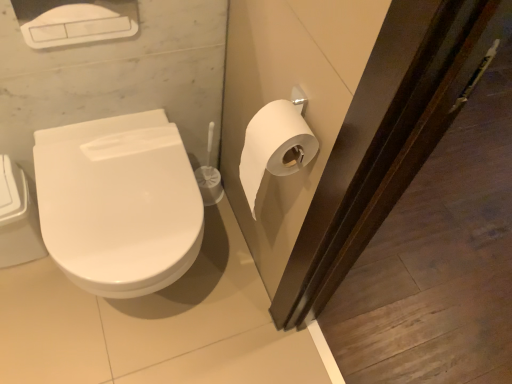
Identify the location of white glossy toilet at left. This screenshot has width=512, height=384. (118, 203).

Describe the element at coordinates (118, 203) in the screenshot. Image resolution: width=512 pixels, height=384 pixels. I see `white glossy toilet at left` at that location.

Measure the distance between white glossy toilet at left and camera.

A distance of 36.21 inches exists between white glossy toilet at left and camera.

Based on the photo, what is the approximate height of white matte toilet paper at right?

white matte toilet paper at right is 11.52 inches tall.

Where is `white matte toilet paper at right`? Image resolution: width=512 pixels, height=384 pixels. white matte toilet paper at right is located at coordinates (274, 148).

The image size is (512, 384). What do you see at coordinates (274, 148) in the screenshot?
I see `white matte toilet paper at right` at bounding box center [274, 148].

Where is `white glossy toilet at left`? This screenshot has height=384, width=512. white glossy toilet at left is located at coordinates (118, 203).

Which is more to the right, white matte toilet paper at right or white glossy toilet at left?

From the viewer's perspective, white matte toilet paper at right appears more on the right side.

Is white matte toilet paper at right positioned before white glossy toilet at left?

Yes, white matte toilet paper at right is in front of white glossy toilet at left.

Considering the points (316, 143) and (58, 228), which point is in front, point (316, 143) or point (58, 228)?

The point (316, 143) is more forward.

From the image's perspective, which one is positioned lower, white matte toilet paper at right or white glossy toilet at left?

white glossy toilet at left appears lower in the image.

From a real-world perspective, is white matte toilet paper at right above or below white glossy toilet at left?

white matte toilet paper at right is situated higher than white glossy toilet at left in the real world.

In terms of width, does white matte toilet paper at right look wider or thinner when compared to white glossy toilet at left?

Clearly, white matte toilet paper at right has less width compared to white glossy toilet at left.

Considering the sizes of objects white matte toilet paper at right and white glossy toilet at left in the image provided, who is shorter, white matte toilet paper at right or white glossy toilet at left?

With less height is white matte toilet paper at right.

Is white matte toilet paper at right bigger than white glossy toilet at left?

No, white matte toilet paper at right is not bigger than white glossy toilet at left.

Is white glossy toilet at left a part of white matte toilet paper at right?

Actually, white glossy toilet at left is outside white matte toilet paper at right.

Are white matte toilet paper at right and white glossy toilet at left located far from each other?

That's not correct — white matte toilet paper at right is a little close to white glossy toilet at left.

Is white matte toilet paper at right facing away from white glossy toilet at left?

No, white glossy toilet at left is not at the back of white matte toilet paper at right.

How different are the orientations of white matte toilet paper at right and white glossy toilet at left in degrees?

The angular difference between white matte toilet paper at right and white glossy toilet at left is 89.8 degrees.

Where is `toilet paper above the white glossy toilet at left (from the image's perspective)`? The image size is (512, 384). toilet paper above the white glossy toilet at left (from the image's perspective) is located at coordinates (274, 148).

Considering the positions of objects white glossy toilet at left and white matte toilet paper at right in the image provided, who is more to the right, white glossy toilet at left or white matte toilet paper at right?

white matte toilet paper at right is more to the right.

Is white glossy toilet at left in front of or behind white matte toilet paper at right in the image?

Clearly, white glossy toilet at left is behind white matte toilet paper at right.

Which is closer, (133, 243) or (286, 130)?

The point (286, 130) is more forward.

From the image's perspective, would you say white glossy toilet at left is shown under white matte toilet paper at right?

Yes, from the image's perspective, white glossy toilet at left is beneath white matte toilet paper at right.

From a real-world perspective, between white glossy toilet at left and white matte toilet paper at right, who is vertically lower?

white glossy toilet at left is physically lower.

Looking at their sizes, would you say white glossy toilet at left is wider or thinner than white matte toilet paper at right?

In the image, white glossy toilet at left appears to be wider than white matte toilet paper at right.

Who is shorter, white glossy toilet at left or white matte toilet paper at right?

white matte toilet paper at right is shorter.

Considering the relative sizes of white glossy toilet at left and white matte toilet paper at right in the image provided, is white glossy toilet at left smaller than white matte toilet paper at right?

Actually, white glossy toilet at left might be larger than white matte toilet paper at right.

Is white glossy toilet at left located outside white matte toilet paper at right?

white glossy toilet at left is positioned outside white matte toilet paper at right.

Is white glossy toilet at left not near white matte toilet paper at right?

white glossy toilet at left is actually quite close to white matte toilet paper at right.

Is white glossy toilet at left aimed at white matte toilet paper at right?

No.

How different are the orientations of white glossy toilet at left and white matte toilet paper at right in degrees?

There is a 89.8-degree angle between the facing directions of white glossy toilet at left and white matte toilet paper at right.

Locate an element on the screen. Image resolution: width=512 pixels, height=384 pixels. toilet paper located above the white glossy toilet at left (from a real-world perspective) is located at coordinates (274, 148).

At what (x,y) coordinates should I click in order to perform the action: click on toilet paper on the right of white glossy toilet at left. Please return your answer as a coordinate pair (x, y). Image resolution: width=512 pixels, height=384 pixels. Looking at the image, I should click on (274, 148).

Where is `toilet paper above the white glossy toilet at left (from a real-world perspective)`? This screenshot has height=384, width=512. toilet paper above the white glossy toilet at left (from a real-world perspective) is located at coordinates point(274,148).